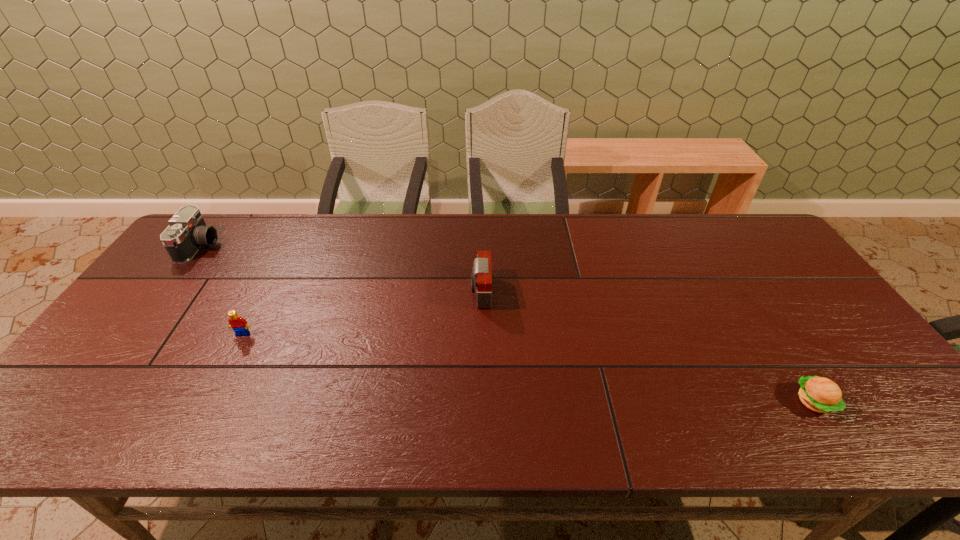
Find the location of a particular element. the right camera is located at coordinates (481, 276).

Where is `the second object from right to left`? the second object from right to left is located at coordinates (481, 276).

You are a GUI agent. You are given a task and a screenshot of the screen. Output one action in this format:
    pyautogui.click(x=<x>, y=<y>)
    Task: Click on the farther camera
    
    Given the screenshot: What is the action you would take?
    click(187, 232)

The image size is (960, 540). I want to click on the farthest object, so click(x=187, y=232).

This screenshot has width=960, height=540. What are the coordinates of `Lego` in the screenshot? It's located at (239, 325).

Where is `the second object from left to right`? Image resolution: width=960 pixels, height=540 pixels. the second object from left to right is located at coordinates 239,325.

At what (x,y) coordinates should I click in order to perform the action: click on the shortest object. Please return your answer as a coordinate pair (x, y). Looking at the image, I should click on (822, 395).

The height and width of the screenshot is (540, 960). What are the coordinates of `the rightmost object` in the screenshot? It's located at (822, 395).

Locate an element on the screen. Image resolution: width=960 pixels, height=540 pixels. free region located on the front-facing side of the third nearest object is located at coordinates (415, 292).

Where is `free region located on the front-facing side of the third nearest object`? This screenshot has width=960, height=540. free region located on the front-facing side of the third nearest object is located at coordinates (443, 292).